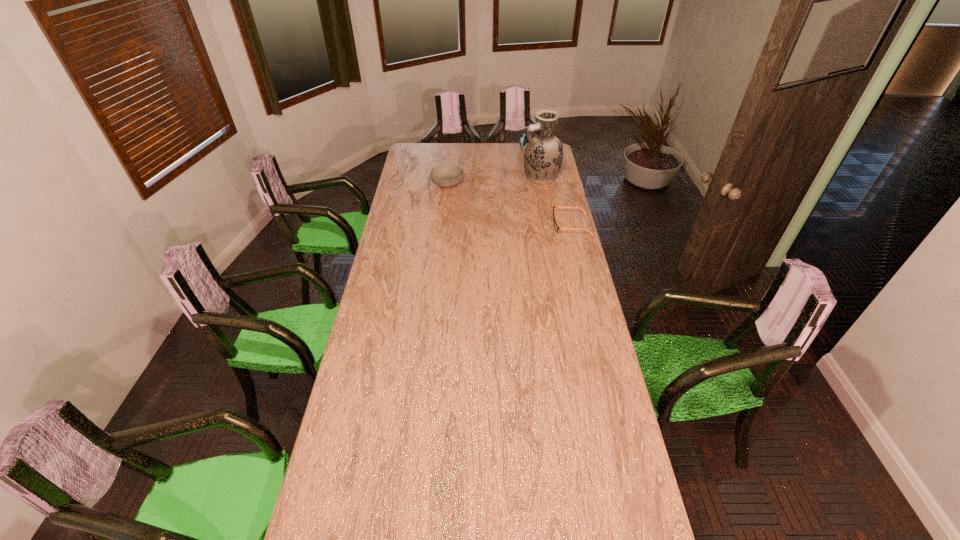
Find the location of a particular element. bowl is located at coordinates (447, 175).

Identify the location of the leftmost object. This screenshot has width=960, height=540. (447, 175).

The image size is (960, 540). What are the coordinates of `the shortest object` in the screenshot? It's located at (556, 227).

The width and height of the screenshot is (960, 540). Identify the location of spectacles. (556, 227).

Where is `the tallest object`? the tallest object is located at coordinates (543, 155).

What are the coordinates of `the third shortest object` in the screenshot? It's located at (522, 138).

Where is `the farthest object`? The image size is (960, 540). the farthest object is located at coordinates (522, 138).

Locate an element on the screen. The height and width of the screenshot is (540, 960). vacant space located on the back of the third tallest object is located at coordinates (449, 169).

Find the location of a particular element. Image resolution: width=960 pixels, height=540 pixels. blank area located on the front-facing side of the spectacles is located at coordinates [x=533, y=225].

Where is `vacant space located 0.160m on the front-facing side of the spectacles`? vacant space located 0.160m on the front-facing side of the spectacles is located at coordinates (520, 225).